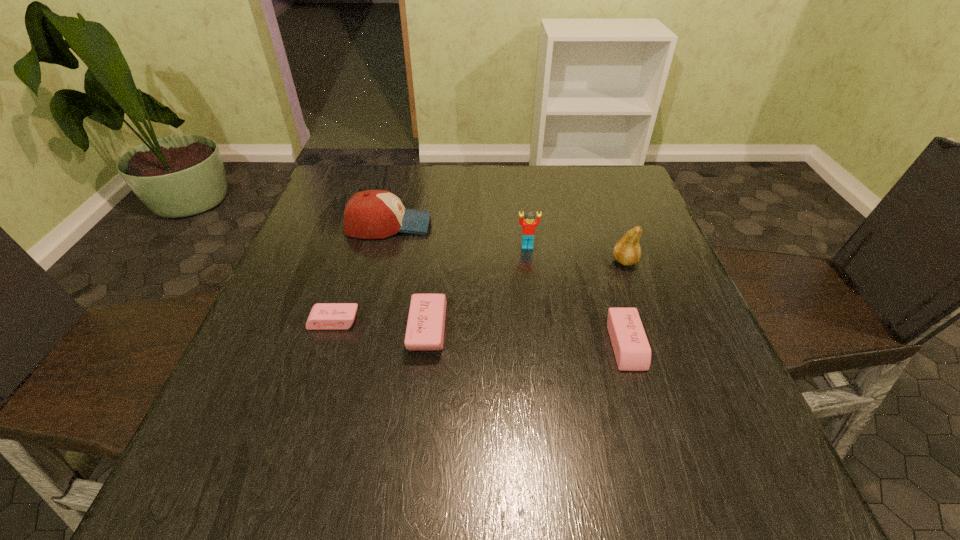
Locate an element on the screen. eraser that can be found as the closest to the third farthest object is located at coordinates (632, 351).

Locate which eraser is the second closest to the pear. Please provide its 2D coordinates. Your answer should be formatted as a tuple, i.e. [(x, y)], where the tuple contains the x and y coordinates of a point satisfying the conditions above.

[(425, 328)]

Identify the location of blank area in the image that satisfies the following two spatial constraints: 1. on the front-facing side of the baseball cap; 2. on the right side of the second tallest eraser. click(x=358, y=345).

The height and width of the screenshot is (540, 960). Find the location of `vacant area in the image that satisfies the following two spatial constraints: 1. on the face of the pear; 2. on the right side of the third object from right to left`. vacant area in the image that satisfies the following two spatial constraints: 1. on the face of the pear; 2. on the right side of the third object from right to left is located at coordinates (529, 261).

Find the location of a particular element. free spot that satisfies the following two spatial constraints: 1. on the front-facing side of the pear; 2. on the left side of the farthest object is located at coordinates (379, 261).

Find the location of a particular element. The image size is (960, 540). vacant point that satisfies the following two spatial constraints: 1. on the face of the Lego; 2. on the left side of the pear is located at coordinates (529, 261).

Find the location of a particular element. vacant area that satisfies the following two spatial constraints: 1. on the face of the third object from right to left; 2. on the right side of the fourth nearest object is located at coordinates (529, 261).

I want to click on vacant space that satisfies the following two spatial constraints: 1. on the front-facing side of the fifth tallest object; 2. on the right side of the farthest object, so click(x=358, y=345).